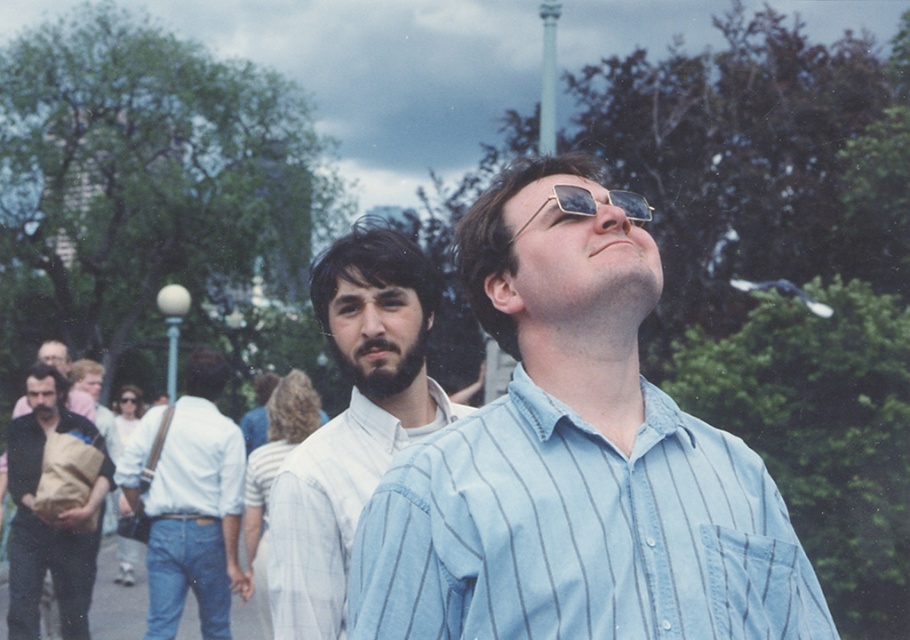
Question: Among these points, which one is nearest to the camera?

Choices:
 (A) (330, 586)
 (B) (91, 404)
 (C) (44, 544)
 (D) (130, 435)

Answer: (A)

Question: In this image, where is white shirt at center located relative to metallic reflective sunglasses at upper center?

Choices:
 (A) below
 (B) above

Answer: (A)

Question: Which point is farther to the camera?

Choices:
 (A) white shirt at center
 (B) metallic reflective sunglasses at upper center
 (C) light blue striped dress shirt at center
 (D) white cotton shirt at center

Answer: (D)

Question: Does brown paper bag at left appear over metallic reflective sunglasses at upper center?

Choices:
 (A) no
 (B) yes

Answer: (A)

Question: Which point is farther to the camera?

Choices:
 (A) (646, 464)
 (B) (17, 614)
 (C) (89, 408)
 (D) (568, 193)

Answer: (C)

Question: Considering the relative positions of light blue striped dress shirt at center and metallic reflective sunglasses at upper center in the image provided, where is light blue striped dress shirt at center located with respect to metallic reflective sunglasses at upper center?

Choices:
 (A) below
 (B) above

Answer: (A)